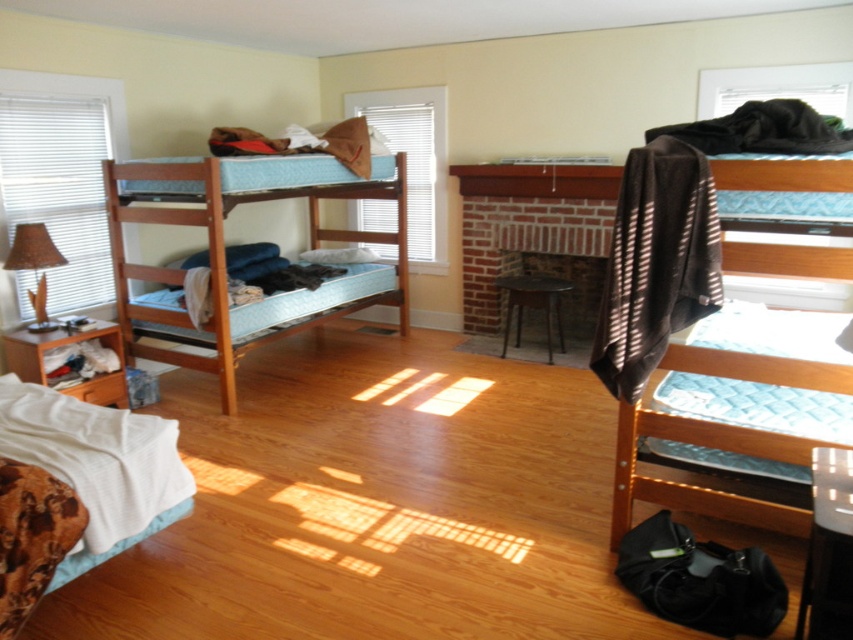
Question: Which point is closer to the camera?

Choices:
 (A) brown fabric lampshade at left
 (B) brown wood drawer at lower left

Answer: (A)

Question: Does brown wood drawer at lower left appear on the left side of brown fabric lampshade at left?

Choices:
 (A) yes
 (B) no

Answer: (B)

Question: Does brown striped towel at upper right come behind brown fabric lampshade at left?

Choices:
 (A) yes
 (B) no

Answer: (B)

Question: Is wooden bunk bed at left smaller than brown fabric lampshade at left?

Choices:
 (A) yes
 (B) no

Answer: (B)

Question: Among these objects, which one is nearest to the camera?

Choices:
 (A) wooden bunk bed at left
 (B) brown striped towel at upper right
 (C) brown wood drawer at lower left
 (D) brown fabric lampshade at left

Answer: (B)

Question: Which of the following is the farthest from the observer?

Choices:
 (A) (614, 522)
 (B) (404, 186)
 (C) (48, 333)
 (D) (48, 259)

Answer: (B)